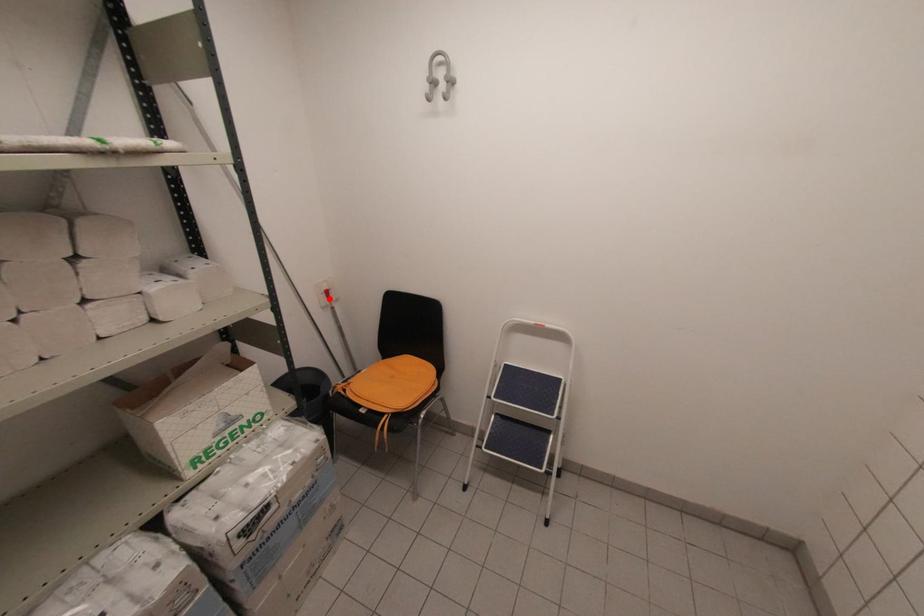
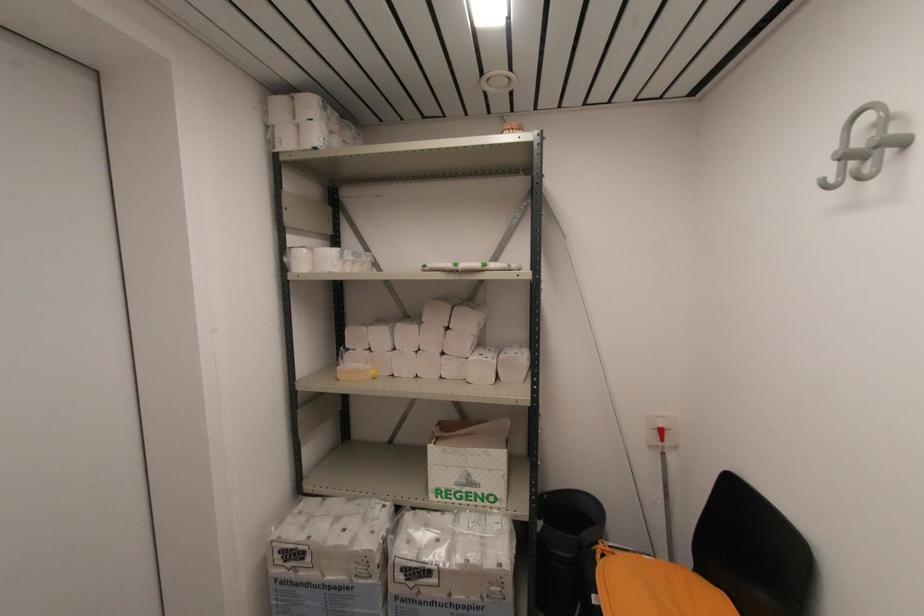
Question: I am providing you with two images of the same scene from different viewpoints. In image1, a red point is highlighted. Considering the same 3D point in image2, which of the following is correct?

Choices:
 (A) It is closer
 (B) It is farther

Answer: (B)